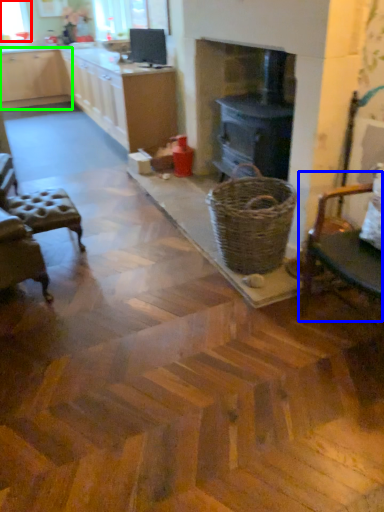
Question: Which is nearer to the window screen (highlighted by a red box)? chair (highlighted by a blue box) or cabinetry (highlighted by a green box).

Choices:
 (A) chair
 (B) cabinetry

Answer: (B)